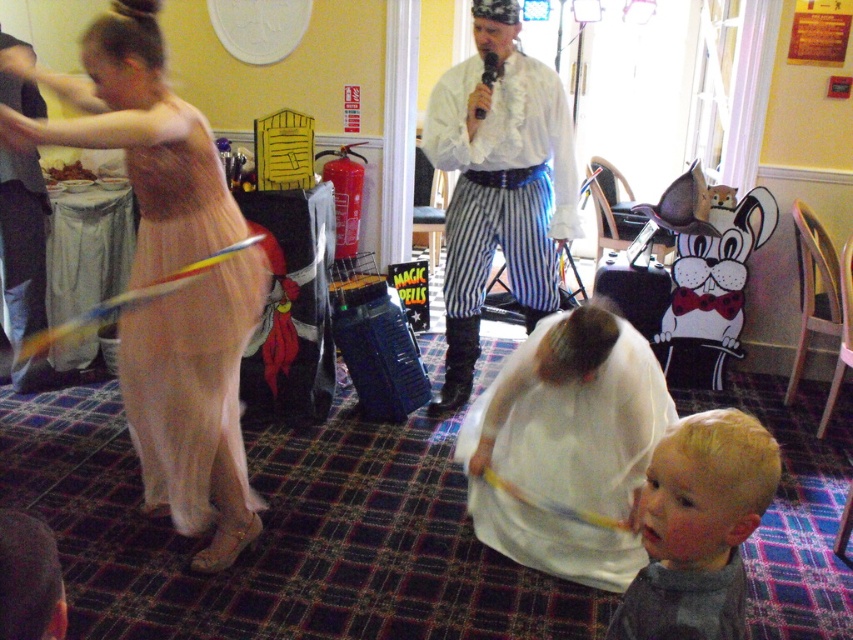
Is white sheer dress at center behind white ruffled shirt at center?

No, white sheer dress at center is in front of white ruffled shirt at center.

Find the location of a particular element. This screenshot has height=640, width=853. white sheer dress at center is located at coordinates (567, 445).

Find the location of a particular element. white sheer dress at center is located at coordinates (567, 445).

Is white sheer dress at center to the right of blonde hair boy at lower right from the viewer's perspective?

Incorrect, white sheer dress at center is not on the right side of blonde hair boy at lower right.

Is white sheer dress at center wider than blonde hair boy at lower right?

Yes, white sheer dress at center is wider than blonde hair boy at lower right.

Between point (474, 420) and point (769, 467), which one is positioned in front?

Point (769, 467)

The height and width of the screenshot is (640, 853). I want to click on white sheer dress at center, so click(567, 445).

Is point (142, 104) positioned in front of point (727, 596)?

No.

At what (x,y) coordinates should I click in order to perform the action: click on matte pink dress at left. Please return your answer as a coordinate pair (x, y). Image resolution: width=853 pixels, height=640 pixels. Looking at the image, I should click on (195, 403).

Is point (247, 273) closer to camera compared to point (733, 584)?

No, (247, 273) is further to viewer.

This screenshot has width=853, height=640. I want to click on matte pink dress at left, so click(x=195, y=403).